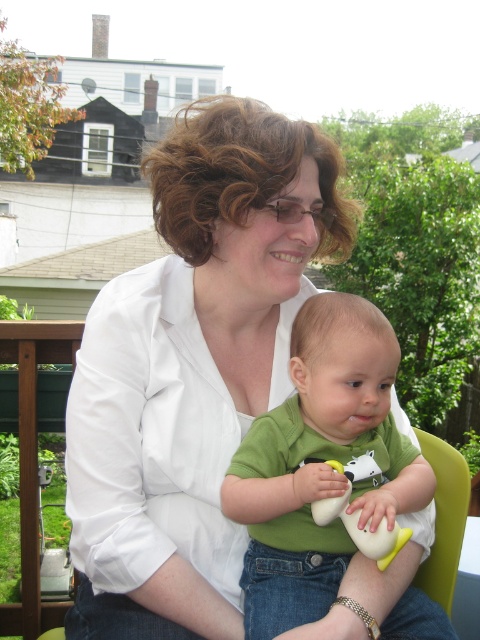
Does white smooth shirt at center have a lesser height compared to white rubber duck at center?

No, white smooth shirt at center is not shorter than white rubber duck at center.

Can you confirm if white smooth shirt at center is bigger than white rubber duck at center?

Correct, white smooth shirt at center is larger in size than white rubber duck at center.

Describe the element at coordinates (192, 368) in the screenshot. I see `white smooth shirt at center` at that location.

What are the coordinates of `white smooth shirt at center` in the screenshot? It's located at (192, 368).

Is point (189, 160) closer to viewer compared to point (327, 561)?

Yes, it is.

Between white smooth shirt at center and green matte shirt at center, which one appears on the right side from the viewer's perspective?

From the viewer's perspective, green matte shirt at center appears more on the right side.

You are a GUI agent. You are given a task and a screenshot of the screen. Output one action in this format:
    pyautogui.click(x=<x>, y=<y>)
    Task: Click on the white smooth shirt at center
    The width and height of the screenshot is (480, 640).
    Given the screenshot: What is the action you would take?
    pyautogui.click(x=192, y=368)

Is point (369, 372) more distant than point (348, 522)?

Yes, it is.

Between green matte shirt at center and white rubber duck at center, which one has less height?

white rubber duck at center

At what (x,y) coordinates should I click in order to perform the action: click on green matte shirt at center. Please return your answer as a coordinate pair (x, y). This screenshot has height=640, width=480. Looking at the image, I should click on (321, 464).